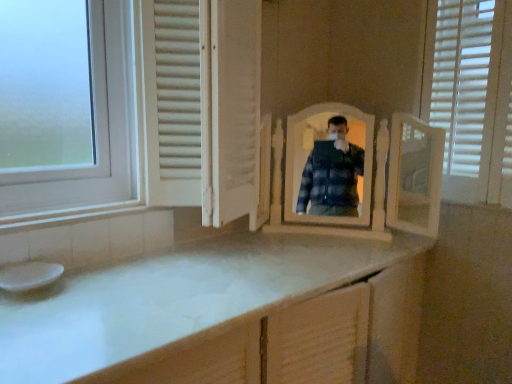
Image resolution: width=512 pixels, height=384 pixels. I want to click on white glossy sink at lower left, so click(31, 281).

Identify the location of white matte screen door at center. This screenshot has width=512, height=384. (199, 102).

What do you see at coordinates (375, 177) in the screenshot? This screenshot has width=512, height=384. I see `white wooden mirror at center` at bounding box center [375, 177].

The height and width of the screenshot is (384, 512). I want to click on white glossy sink at lower left, so click(31, 281).

Locate an element on the screen. screen door that appears on the right of white glossy sink at lower left is located at coordinates (199, 102).

From the image's perspective, does white matte screen door at center appear higher than white glossy sink at lower left?

Correct, white matte screen door at center appears higher than white glossy sink at lower left in the image.

Does white matte screen door at center have a greater height compared to white glossy sink at lower left?

Yes.

Consider the image. Can you tell me how much white matte screen door at center and white glossy sink at lower left differ in facing direction?

white matte screen door at center and white glossy sink at lower left are facing 2.24 degrees away from each other.

In terms of width, does white wooden mirror at center look wider or thinner when compared to white matte screen door at center?

Considering their sizes, white wooden mirror at center looks slimmer than white matte screen door at center.

From the picture: Can we say white wooden mirror at center lies outside white matte screen door at center?

Yes, white wooden mirror at center is outside of white matte screen door at center.

Measure the distance between white wooden mirror at center and white matte screen door at center.

They are 23.07 inches apart.

How much distance is there between white glossy sink at lower left and white wooden mirror at center?

A distance of 1.16 meters exists between white glossy sink at lower left and white wooden mirror at center.

Which object is further away from the camera, white glossy sink at lower left or white wooden mirror at center?

white wooden mirror at center is more distant.

Considering the relative sizes of white glossy sink at lower left and white wooden mirror at center in the image provided, is white glossy sink at lower left shorter than white wooden mirror at center?

Indeed, white glossy sink at lower left has a lesser height compared to white wooden mirror at center.

Where is `mirror lying behind the white glossy sink at lower left`? mirror lying behind the white glossy sink at lower left is located at coordinates (375, 177).

From a real-world perspective, is white wooden mirror at center beneath white glossy sink at lower left?

Incorrect, from a real-world perspective, white wooden mirror at center is higher than white glossy sink at lower left.

Is white wooden mirror at center turned away from white glossy sink at lower left?

No.

Considering the points (390, 190) and (31, 279), which point is behind, point (390, 190) or point (31, 279)?

Point (390, 190)

Are white wooden mirror at center and white glossy sink at lower left making contact?

No, white wooden mirror at center is not making contact with white glossy sink at lower left.

How different are the orientations of white glossy sink at lower left and white matte screen door at center in degrees?

The facing directions of white glossy sink at lower left and white matte screen door at center are 2.24 degrees apart.

From the image's perspective, which object appears higher, white glossy sink at lower left or white matte screen door at center?

white matte screen door at center appears higher in the image.

Is white glossy sink at lower left wider or thinner than white matte screen door at center?

Considering their sizes, white glossy sink at lower left looks slimmer than white matte screen door at center.

Which of these two, white glossy sink at lower left or white matte screen door at center, stands taller?

Standing taller between the two is white matte screen door at center.

Is white matte screen door at center facing away from white wooden mirror at center?

No, white matte screen door at center is not facing the opposite direction of white wooden mirror at center.

In the scene shown: Which of these two, white matte screen door at center or white wooden mirror at center, is wider?

Wider between the two is white matte screen door at center.

In the scene shown: From a real-world perspective, between white matte screen door at center and white wooden mirror at center, who is vertically higher?

From a 3D spatial view, white matte screen door at center is above.

Based on the photo, measure the distance between white matte screen door at center and white wooden mirror at center.

A distance of 23.07 inches exists between white matte screen door at center and white wooden mirror at center.

Where is `sink that is below the white matte screen door at center (from the image's perspective)`? sink that is below the white matte screen door at center (from the image's perspective) is located at coordinates (31, 281).

Find the location of a particular element. screen door above the white wooden mirror at center (from the image's perspective) is located at coordinates (199, 102).

From the image, which object appears to be farther from white wooden mirror at center, white glossy sink at lower left or white matte screen door at center?

Among the two, white glossy sink at lower left is located further to white wooden mirror at center.

From the picture: Based on their spatial positions, is white wooden mirror at center or white matte screen door at center closer to white glossy sink at lower left?

white matte screen door at center.

In the scene shown: Looking at the image, which one is located closer to white matte screen door at center, white wooden mirror at center or white glossy sink at lower left?

white wooden mirror at center is closer to white matte screen door at center.

From the image, which object appears to be nearer to white matte screen door at center, white glossy sink at lower left or white wooden mirror at center?

The object closer to white matte screen door at center is white wooden mirror at center.

When comparing their distances from white glossy sink at lower left, does white matte screen door at center or white wooden mirror at center seem closer?

white matte screen door at center is positioned closer to the anchor white glossy sink at lower left.

Based on their spatial positions, is white matte screen door at center or white glossy sink at lower left further from white wooden mirror at center?

white glossy sink at lower left is positioned further to the anchor white wooden mirror at center.

I want to click on screen door between white glossy sink at lower left and white wooden mirror at center, so click(x=199, y=102).